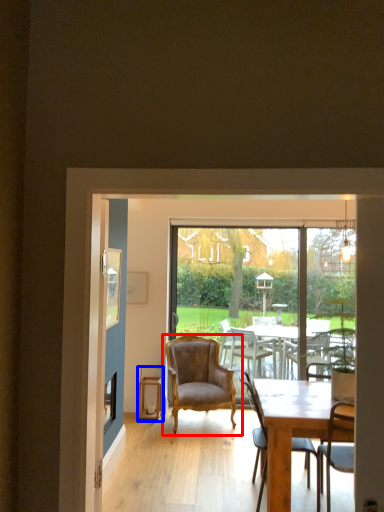
Question: Which point is closer to the camera, chair (highlighted by a red box) or stool (highlighted by a blue box)?

Choices:
 (A) chair
 (B) stool

Answer: (A)